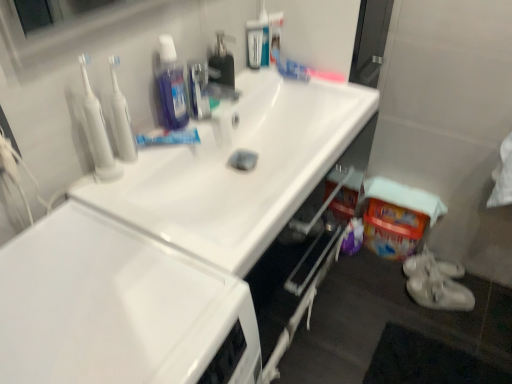
Question: Which direction should I rotate to look at clear plastic bottle at upper center, the third cleaning products when ordered from left to right?

Choices:
 (A) left
 (B) right

Answer: (A)

Question: Does translucent purple bottle at upper center, which appears as the fourth cleaning products when viewed from the right, lie in front of white plastic toothbrushes at upper left, which is the second cleanser from right to left?

Choices:
 (A) yes
 (B) no

Answer: (B)

Question: Does translucent purple bottle at upper center, which appears as the fourth cleaning products when viewed from the right, turn towards white plastic toothbrushes at upper left, which ranks as the 1th cleanser in left-to-right order?

Choices:
 (A) no
 (B) yes

Answer: (A)

Question: Can you confirm if translucent purple bottle at upper center, which appears as the fourth cleaning products when viewed from the right, is bigger than white plastic toothbrushes at upper left, which ranks as the 1th cleanser in left-to-right order?

Choices:
 (A) yes
 (B) no

Answer: (A)

Question: Is translucent purple bottle at upper center, which appears as the fourth cleaning products when viewed from the right, to the right of white plastic toothbrushes at upper left, which is the second cleanser from right to left, from the viewer's perspective?

Choices:
 (A) no
 (B) yes

Answer: (B)

Question: Considering the relative sizes of translucent purple bottle at upper center, which is counted as the first cleaning products, starting from the left, and white plastic toothbrushes at upper left, which is the second cleanser from right to left, in the image provided, is translucent purple bottle at upper center, which is counted as the first cleaning products, starting from the left, shorter than white plastic toothbrushes at upper left, which is the second cleanser from right to left,?

Choices:
 (A) yes
 (B) no

Answer: (A)

Question: From the image's perspective, is translucent purple bottle at upper center, which appears as the fourth cleaning products when viewed from the right, beneath white plastic toothbrushes at upper left, which is the second cleanser from right to left?

Choices:
 (A) yes
 (B) no

Answer: (B)

Question: Can you confirm if clear plastic bottle at upper center, positioned as the second cleaning products in right-to-left order, is thinner than translucent plastic bottle at upper center, placed as the 4th cleaning products when sorted from left to right?

Choices:
 (A) yes
 (B) no

Answer: (B)

Question: Considering the relative positions of clear plastic bottle at upper center, the third cleaning products when ordered from left to right, and translucent plastic bottle at upper center, the first cleaning products when ordered from right to left, in the image provided, is clear plastic bottle at upper center, the third cleaning products when ordered from left to right, to the left of translucent plastic bottle at upper center, the first cleaning products when ordered from right to left, from the viewer's perspective?

Choices:
 (A) yes
 (B) no

Answer: (A)

Question: Is clear plastic bottle at upper center, the third cleaning products when ordered from left to right, taller than translucent plastic bottle at upper center, the first cleaning products when ordered from right to left?

Choices:
 (A) no
 (B) yes

Answer: (A)

Question: Is clear plastic bottle at upper center, positioned as the second cleaning products in right-to-left order, oriented towards translucent plastic bottle at upper center, the first cleaning products when ordered from right to left?

Choices:
 (A) no
 (B) yes

Answer: (A)

Question: Considering the relative sizes of clear plastic bottle at upper center, the third cleaning products when ordered from left to right, and translucent plastic bottle at upper center, the first cleaning products when ordered from right to left, in the image provided, is clear plastic bottle at upper center, the third cleaning products when ordered from left to right, smaller than translucent plastic bottle at upper center, the first cleaning products when ordered from right to left,?

Choices:
 (A) no
 (B) yes

Answer: (B)

Question: Is clear plastic bottle at upper center, positioned as the second cleaning products in right-to-left order, at the right side of translucent plastic bottle at upper center, the first cleaning products when ordered from right to left?

Choices:
 (A) no
 (B) yes

Answer: (A)

Question: Is white fabric towel at lower right positioned far away from metallic silver faucet at upper center?

Choices:
 (A) yes
 (B) no

Answer: (B)